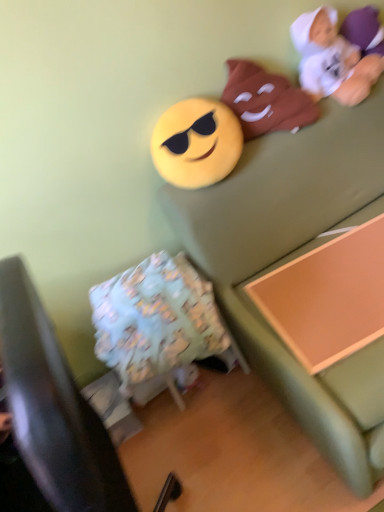
Locate an element on the screen. matte brown plush at upper right, the 2th toy in the right-to-left sequence is located at coordinates (265, 100).

Where is `fluffy fabric pillow at lower left`? fluffy fabric pillow at lower left is located at coordinates (54, 408).

Measure the distance between yellow matte emoji at upper center, which is the 1th toy from left to right, and camera.

yellow matte emoji at upper center, which is the 1th toy from left to right, and camera are 1.32 meters apart.

The height and width of the screenshot is (512, 384). What are the coordinates of `soft green couch at upper right` in the screenshot? It's located at pyautogui.click(x=288, y=246).

What do you see at coordinates (157, 325) in the screenshot? I see `light blue fabric bean bag chair at lower left` at bounding box center [157, 325].

Locate an element on the screen. orange wood changing table at lower right is located at coordinates (327, 297).

From the picture: Can white plush toy at upper right, which is the first toy from right to left, be found inside soft green couch at upper right?

Definitely not — white plush toy at upper right, which is the first toy from right to left, is not inside soft green couch at upper right.

Locate an element on the screen. The height and width of the screenshot is (512, 384). couch located below the white plush toy at upper right, which is the first toy from right to left (from the image's perspective) is located at coordinates (288, 246).

From a real-world perspective, is soft green couch at upper right located beneath white plush toy at upper right, which is the first toy from right to left?

Yes, from a real-world perspective, soft green couch at upper right is under white plush toy at upper right, which is the first toy from right to left.

From the image's perspective, relative to white plush toy at upper right, which is the first toy from right to left, is soft green couch at upper right above or below?

Clearly, from the image's perspective, soft green couch at upper right is below white plush toy at upper right, which is the first toy from right to left.

Is matte brown plush at upper right, marked as the 2th toy in a left-to-right arrangement, next to light blue fabric bean bag chair at lower left and touching it?

No, matte brown plush at upper right, marked as the 2th toy in a left-to-right arrangement, is not with light blue fabric bean bag chair at lower left.

Is matte brown plush at upper right, the 2th toy in the right-to-left sequence, looking in the opposite direction of light blue fabric bean bag chair at lower left?

No, matte brown plush at upper right, the 2th toy in the right-to-left sequence, is not facing away from light blue fabric bean bag chair at lower left.

There is a light blue fabric bean bag chair at lower left. Where is `the 2nd toy above it (from the image's perspective)`? The height and width of the screenshot is (512, 384). the 2nd toy above it (from the image's perspective) is located at coordinates (265, 100).

Considering the relative positions of matte brown plush at upper right, marked as the 2th toy in a left-to-right arrangement, and light blue fabric bean bag chair at lower left in the image provided, is matte brown plush at upper right, marked as the 2th toy in a left-to-right arrangement, to the left or to the right of light blue fabric bean bag chair at lower left?

matte brown plush at upper right, marked as the 2th toy in a left-to-right arrangement, is to the right of light blue fabric bean bag chair at lower left.

Considering the relative positions of fluffy fabric pillow at lower left and white plush toy at upper right, which is the first toy from right to left, in the image provided, is fluffy fabric pillow at lower left to the left or to the right of white plush toy at upper right, which is the first toy from right to left,?

From the image, it's evident that fluffy fabric pillow at lower left is to the left of white plush toy at upper right, which is the first toy from right to left.

From the image's perspective, is fluffy fabric pillow at lower left beneath white plush toy at upper right, which is the first toy from right to left?

Correct, fluffy fabric pillow at lower left appears lower than white plush toy at upper right, which is the first toy from right to left, in the image.

Considering the sizes of fluffy fabric pillow at lower left and white plush toy at upper right, arranged as the 3th toy when viewed from the left, in the image, is fluffy fabric pillow at lower left taller or shorter than white plush toy at upper right, arranged as the 3th toy when viewed from the left,?

In the image, fluffy fabric pillow at lower left appears to be taller than white plush toy at upper right, arranged as the 3th toy when viewed from the left.

Where is `furniture lying in front of the white plush toy at upper right, arranged as the 3th toy when viewed from the left`? furniture lying in front of the white plush toy at upper right, arranged as the 3th toy when viewed from the left is located at coordinates (54, 408).

Can you tell me how much yellow matte emoji at upper center, which appears as the third toy when viewed from the right, and orange wood changing table at lower right differ in facing direction?

They differ by 4.95 degrees in their facing directions.

Choose the correct answer: Is yellow matte emoji at upper center, which appears as the third toy when viewed from the right, inside orange wood changing table at lower right or outside it?

The correct answer is: outside.

Is yellow matte emoji at upper center, which appears as the third toy when viewed from the right, looking in the opposite direction of orange wood changing table at lower right?

That's not correct — yellow matte emoji at upper center, which appears as the third toy when viewed from the right, is not looking away from orange wood changing table at lower right.

From a real-world perspective, is yellow matte emoji at upper center, which appears as the third toy when viewed from the right, physically below orange wood changing table at lower right?

No.

Which object is wider, matte brown plush at upper right, the 2th toy in the right-to-left sequence, or fluffy fabric pillow at lower left?

fluffy fabric pillow at lower left is wider.

Is matte brown plush at upper right, marked as the 2th toy in a left-to-right arrangement, outside of fluffy fabric pillow at lower left?

That's correct, matte brown plush at upper right, marked as the 2th toy in a left-to-right arrangement, is outside of fluffy fabric pillow at lower left.

The height and width of the screenshot is (512, 384). I want to click on furniture in front of the matte brown plush at upper right, the 2th toy in the right-to-left sequence, so tap(54, 408).

From the image's perspective, is matte brown plush at upper right, the 2th toy in the right-to-left sequence, beneath soft green couch at upper right?

No, from the image's perspective, matte brown plush at upper right, the 2th toy in the right-to-left sequence, is not below soft green couch at upper right.

Does matte brown plush at upper right, marked as the 2th toy in a left-to-right arrangement, turn towards soft green couch at upper right?

No, matte brown plush at upper right, marked as the 2th toy in a left-to-right arrangement, is not oriented towards soft green couch at upper right.

Is matte brown plush at upper right, the 2th toy in the right-to-left sequence, bigger than soft green couch at upper right?

No.

Can you tell me how much matte brown plush at upper right, the 2th toy in the right-to-left sequence, and soft green couch at upper right differ in facing direction?

0.159 degrees.

From the image's perspective, is yellow matte emoji at upper center, which appears as the third toy when viewed from the right, above matte brown plush at upper right, marked as the 2th toy in a left-to-right arrangement?

Incorrect, from the image's perspective, yellow matte emoji at upper center, which appears as the third toy when viewed from the right, is lower than matte brown plush at upper right, marked as the 2th toy in a left-to-right arrangement.

Who is shorter, yellow matte emoji at upper center, which is the 1th toy from left to right, or matte brown plush at upper right, marked as the 2th toy in a left-to-right arrangement?

With less height is yellow matte emoji at upper center, which is the 1th toy from left to right.

Does yellow matte emoji at upper center, which appears as the third toy when viewed from the right, turn towards matte brown plush at upper right, marked as the 2th toy in a left-to-right arrangement?

No, yellow matte emoji at upper center, which appears as the third toy when viewed from the right, is not facing towards matte brown plush at upper right, marked as the 2th toy in a left-to-right arrangement.

Based on the photo, between yellow matte emoji at upper center, which appears as the third toy when viewed from the right, and matte brown plush at upper right, marked as the 2th toy in a left-to-right arrangement, which one has larger size?

Bigger between the two is matte brown plush at upper right, marked as the 2th toy in a left-to-right arrangement.

Where is `the 3rd toy positioned above the soft green couch at upper right (from the image's perspective)`? This screenshot has height=512, width=384. the 3rd toy positioned above the soft green couch at upper right (from the image's perspective) is located at coordinates (332, 59).

The image size is (384, 512). Identify the location of bean bag chair below the matte brown plush at upper right, marked as the 2th toy in a left-to-right arrangement (from the image's perspective). (157, 325).

Estimate the real-world distances between objects in this image. Which object is closer to light blue fabric bean bag chair at lower left, soft green couch at upper right or orange wood changing table at lower right?

soft green couch at upper right lies closer to light blue fabric bean bag chair at lower left than the other object.

When comparing their distances from matte brown plush at upper right, the 2th toy in the right-to-left sequence, does white plush toy at upper right, which is the first toy from right to left, or light blue fabric bean bag chair at lower left seem closer?

white plush toy at upper right, which is the first toy from right to left, is positioned closer to the anchor matte brown plush at upper right, the 2th toy in the right-to-left sequence.

Based on their spatial positions, is yellow matte emoji at upper center, which appears as the third toy when viewed from the right, or orange wood changing table at lower right further from light blue fabric bean bag chair at lower left?

yellow matte emoji at upper center, which appears as the third toy when viewed from the right, is further to light blue fabric bean bag chair at lower left.

Looking at the image, which one is located further to soft green couch at upper right, matte brown plush at upper right, marked as the 2th toy in a left-to-right arrangement, or yellow matte emoji at upper center, which is the 1th toy from left to right?

matte brown plush at upper right, marked as the 2th toy in a left-to-right arrangement, is positioned further to the anchor soft green couch at upper right.

Which object lies further to the anchor point matte brown plush at upper right, the 2th toy in the right-to-left sequence, light blue fabric bean bag chair at lower left or yellow matte emoji at upper center, which appears as the third toy when viewed from the right?

light blue fabric bean bag chair at lower left is positioned further to the anchor matte brown plush at upper right, the 2th toy in the right-to-left sequence.

Looking at the image, which one is located further to matte brown plush at upper right, the 2th toy in the right-to-left sequence, yellow matte emoji at upper center, which appears as the third toy when viewed from the right, or light blue fabric bean bag chair at lower left?

The object further to matte brown plush at upper right, the 2th toy in the right-to-left sequence, is light blue fabric bean bag chair at lower left.

From the image, which object appears to be nearer to fluffy fabric pillow at lower left, light blue fabric bean bag chair at lower left or soft green couch at upper right?

light blue fabric bean bag chair at lower left.

Looking at the image, which one is located closer to orange wood changing table at lower right, fluffy fabric pillow at lower left or soft green couch at upper right?

soft green couch at upper right is closer to orange wood changing table at lower right.

Image resolution: width=384 pixels, height=512 pixels. I want to click on changing table situated between yellow matte emoji at upper center, which is the 1th toy from left to right, and soft green couch at upper right from left to right, so click(x=327, y=297).

At what (x,y) coordinates should I click in order to perform the action: click on changing table between matte brown plush at upper right, marked as the 2th toy in a left-to-right arrangement, and fluffy fabric pillow at lower left vertically. Please return your answer as a coordinate pair (x, y). This screenshot has width=384, height=512. Looking at the image, I should click on (327, 297).

Locate an element on the screen. changing table between white plush toy at upper right, arranged as the 3th toy when viewed from the left, and light blue fabric bean bag chair at lower left from top to bottom is located at coordinates (327, 297).

This screenshot has height=512, width=384. What are the coordinates of `changing table between white plush toy at upper right, which is the first toy from right to left, and fluffy fabric pillow at lower left in the up-down direction` in the screenshot? It's located at (327, 297).